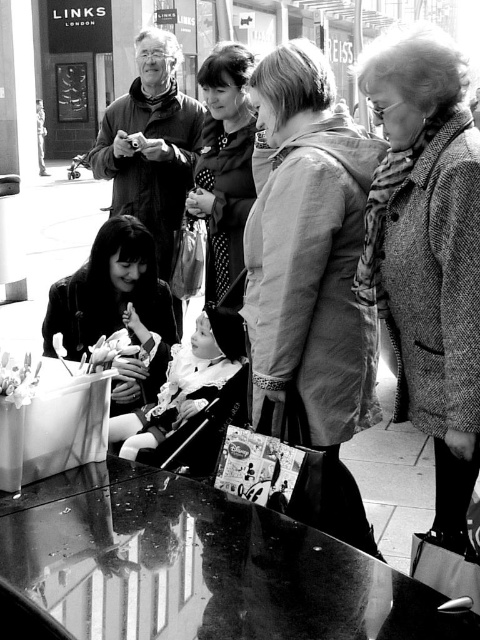
This screenshot has width=480, height=640. What do you see at coordinates (151, 145) in the screenshot?
I see `matte black jacket at upper left` at bounding box center [151, 145].

The height and width of the screenshot is (640, 480). What are the coordinates of `matte black jacket at upper left` in the screenshot? It's located at (151, 145).

Who is more forward, (71, 568) or (168, 93)?

Point (71, 568) is more forward.

Does glossy glass table at lower center lie in front of matte black jacket at upper left?

Yes, it is.

Which is in front, point (159, 611) or point (165, 120)?

Point (159, 611) is more forward.

Where is `glossy glass table at lower center`? glossy glass table at lower center is located at coordinates (199, 564).

Does coarse wool coat at right have a lesser height compared to glass table at lower left?

No.

Which is in front, point (451, 211) or point (50, 384)?

Point (451, 211) is more forward.

You are a GUI agent. You are given a task and a screenshot of the screen. Output one action in this format:
    pyautogui.click(x=<x>, y=<y>)
    Task: Click on the coarse wool coat at right
    
    Given the screenshot: What is the action you would take?
    (x=428, y=253)